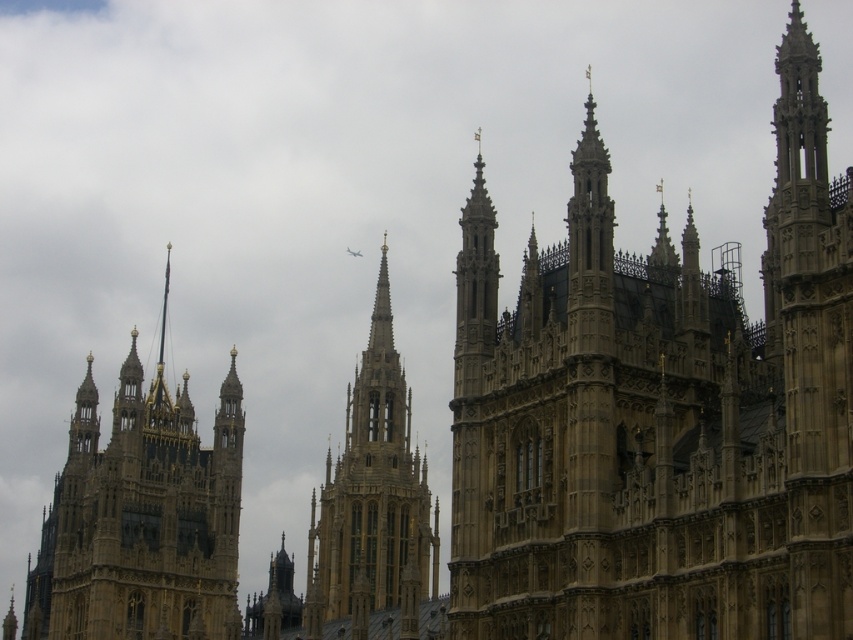
You are an architect analyzing the Palace of Westminster. You notice two golden stone structures in the image. Which one is shorter between the golden stone tower at center and the golden stone spire at center?

The golden stone tower at center is shorter than the golden stone spire at center.

Looking at this image, you are an architect examining the Palace of Westminster. You notice two golden stone structures in the image. Which one is taller between the golden stone tower at center and the golden stone spire at left?

The golden stone spire at left is taller than the golden stone tower at center.